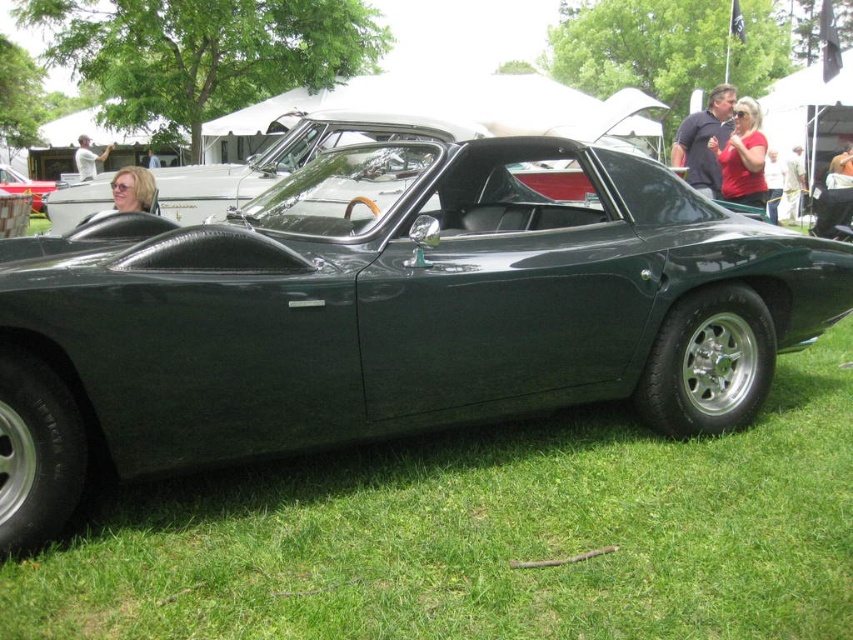
Locate an element on the screen. dark blue shirt at upper center is located at coordinates (704, 140).

Is matte red shirt at upper right shorter than matte blonde hair at center?

Indeed, matte red shirt at upper right has a lesser height compared to matte blonde hair at center.

Is the position of matte red shirt at upper right less distant than that of matte blonde hair at center?

That is False.

The width and height of the screenshot is (853, 640). In order to click on matte red shirt at upper right in this screenshot , I will do `click(741, 156)`.

Where is `matte red shirt at upper right`? The width and height of the screenshot is (853, 640). matte red shirt at upper right is located at coordinates (741, 156).

Which is in front, point (26, 180) or point (833, 186)?

Point (833, 186) is in front.

Can you confirm if green matte sports car at center is wider than light brown leather jacket at center?

Yes.

Is point (19, 192) less distant than point (846, 147)?

That is True.

The image size is (853, 640). Identify the location of green matte sports car at center. (25, 186).